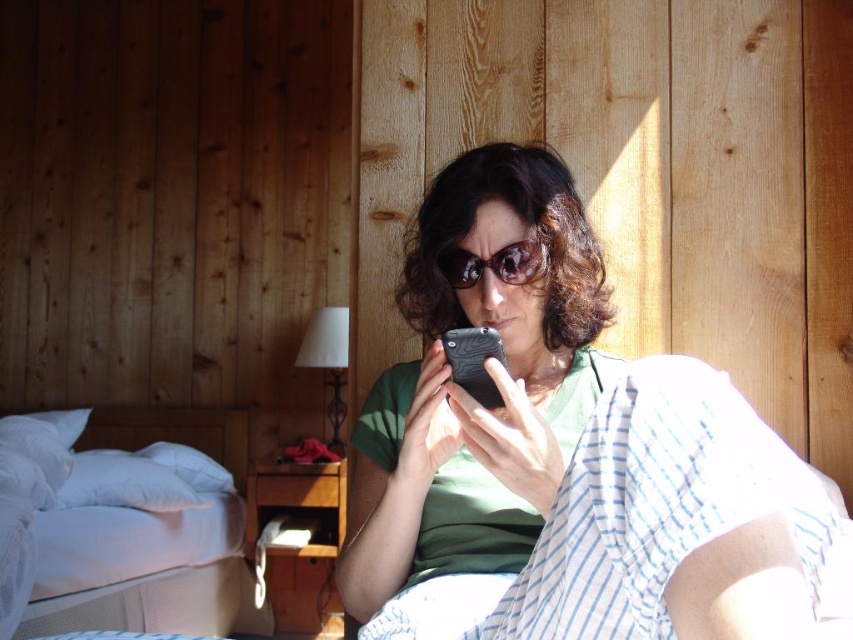
Question: Can you confirm if white soft bed at lower left is positioned above black matte smartphone at center?

Choices:
 (A) yes
 (B) no

Answer: (B)

Question: Which point appears farthest from the camera in this image?

Choices:
 (A) (498, 275)
 (B) (102, 572)
 (C) (506, 413)
 (D) (479, 349)

Answer: (B)

Question: Is the position of matte black phone at center more distant than that of shiny brown sunglasses at center?

Choices:
 (A) yes
 (B) no

Answer: (B)

Question: Among these points, which one is nearest to the camera?

Choices:
 (A) (480, 305)
 (B) (450, 365)
 (C) (482, 269)

Answer: (B)

Question: Can you confirm if white soft bed at lower left is bigger than shiny brown sunglasses at center?

Choices:
 (A) yes
 (B) no

Answer: (A)

Question: Based on their relative distances, which object is nearer to the shiny brown sunglasses at center?

Choices:
 (A) white soft bed at lower left
 (B) black matte smartphone at center

Answer: (B)